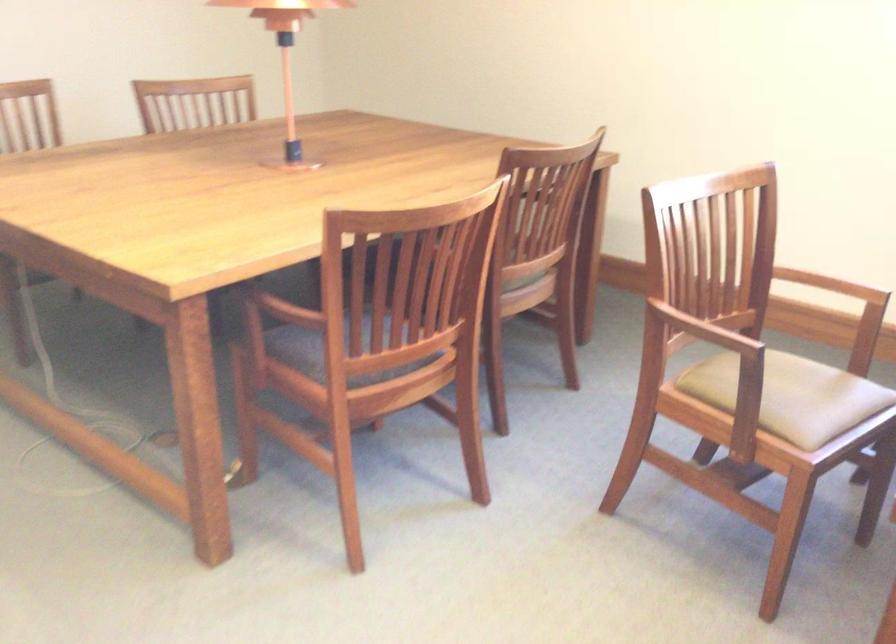
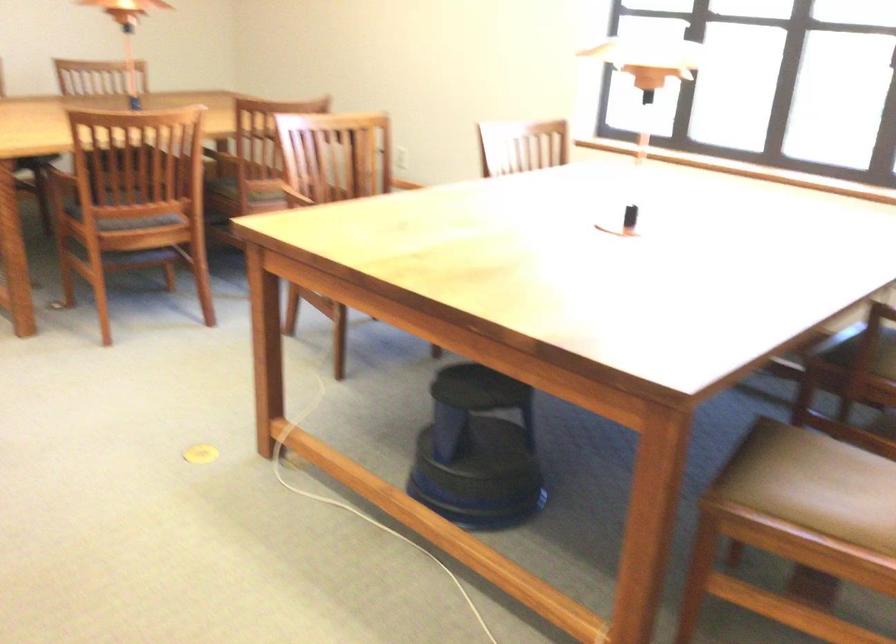
In the second image, find the point that corresponds to pixel 651 308 in the first image.

(303, 194)